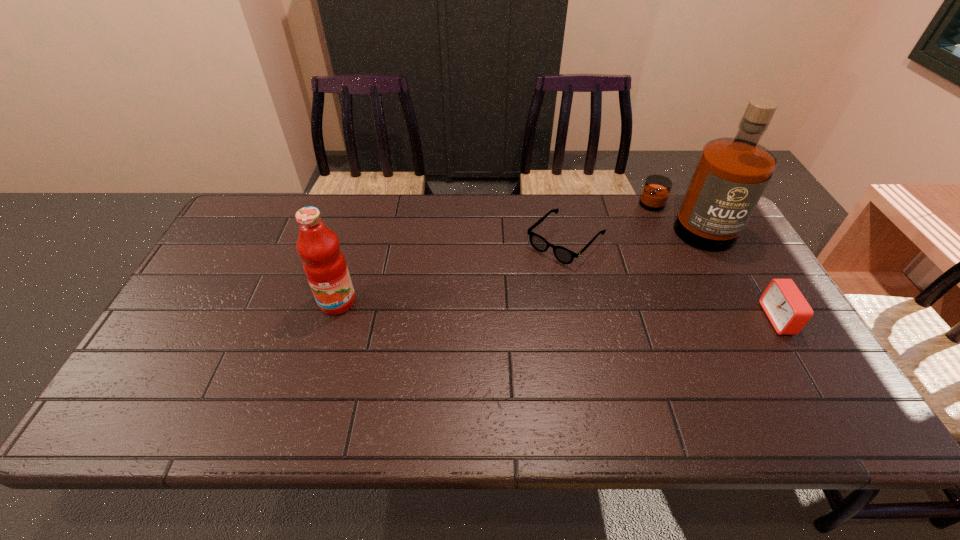
This screenshot has height=540, width=960. What are the coordinates of `unoccupied area between the third shortest object and the liquor` in the screenshot? It's located at (513, 262).

Where is `vacant area that lies between the tallest object and the second object from left to right`? vacant area that lies between the tallest object and the second object from left to right is located at coordinates (626, 232).

The height and width of the screenshot is (540, 960). In order to click on free point between the shortest object and the tallest object in this screenshot , I will do `click(626, 232)`.

I want to click on free space between the shortest object and the second shortest object, so click(671, 280).

The height and width of the screenshot is (540, 960). Find the location of `vacant space that's between the second shortest object and the fruit juice`. vacant space that's between the second shortest object and the fruit juice is located at coordinates (558, 310).

Identify the location of the second closest object to the tallest object. The height and width of the screenshot is (540, 960). (788, 311).

Select which object appears as the third closest to the tallest object. Please provide its 2D coordinates. Your answer should be formatted as a tuple, i.e. [(x, y)], where the tuple contains the x and y coordinates of a point satisfying the conditions above.

[(324, 264)]

Find the location of a particular element. This screenshot has width=960, height=540. vacant area in the image that satisfies the following two spatial constraints: 1. on the front label of the second tallest object; 2. on the front-facing side of the third tallest object is located at coordinates (332, 319).

At what (x,y) coordinates should I click in order to perform the action: click on blank area in the image that satisfies the following two spatial constraints: 1. on the front label of the fruit juice; 2. on the front-facing side of the alarm clock. Please return your answer as a coordinate pair (x, y). The width and height of the screenshot is (960, 540). Looking at the image, I should click on (332, 319).

This screenshot has height=540, width=960. What are the coordinates of `vacant space that satisfies the following two spatial constraints: 1. on the back side of the shortest object; 2. on the right side of the liquor` in the screenshot? It's located at (562, 222).